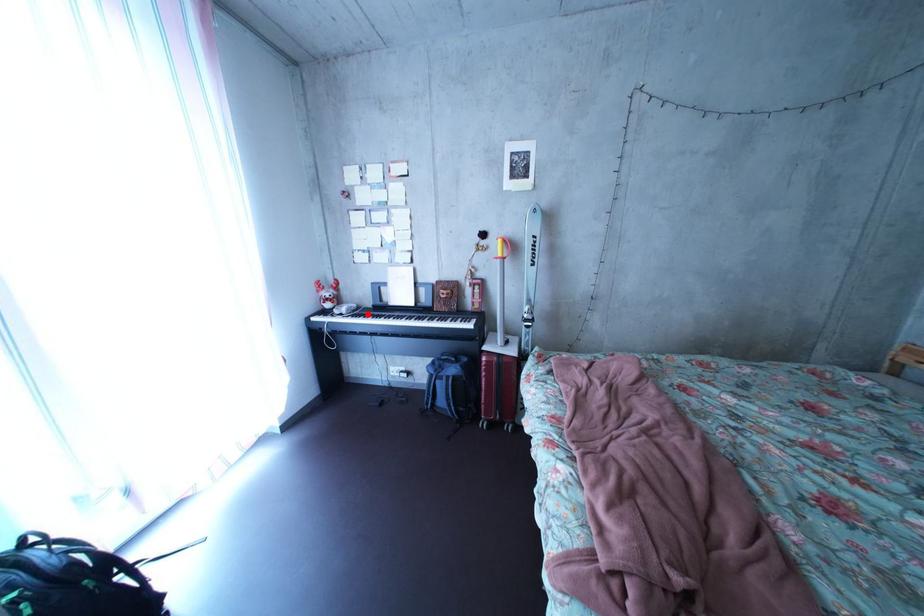
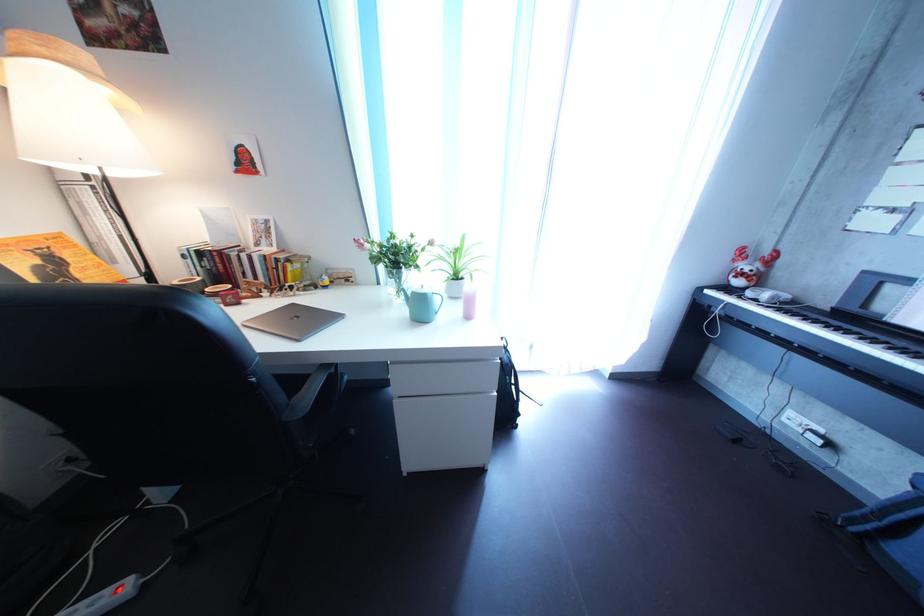
The point at the highlighted location is marked in the first image. Where is the corresponding point in the second image?

(801, 304)